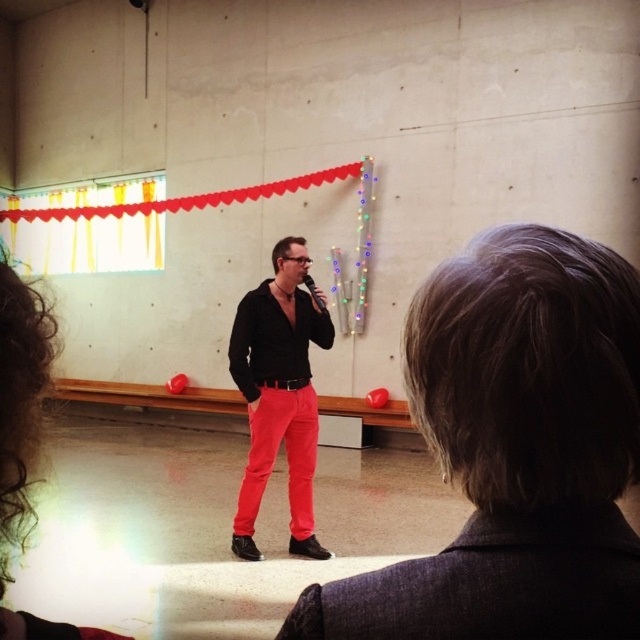
You are a photographer positioned at the back of the stage. You want to capture a photo where the bright red cotton pants at center and the black matte microphone at center are both clearly visible. Which object should you adjust your camera focus to first to ensure both are in frame?

The bright red cotton pants at center are to the left of the black matte microphone at center. Since the microphone is closer to the right side, adjusting focus starting from the microphone and panning left will ensure both objects remain in frame.